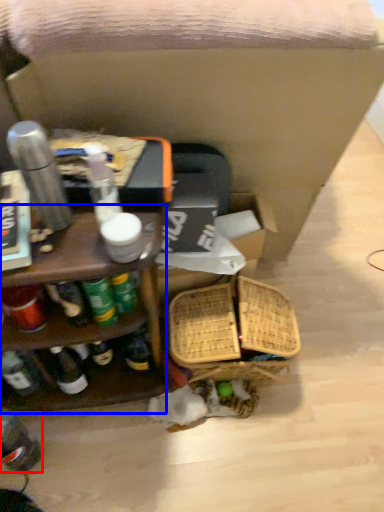
Question: Which of the following is the farthest to the observer, bottle (highlighted by a red box) or shelf (highlighted by a blue box)?

Choices:
 (A) bottle
 (B) shelf

Answer: (A)